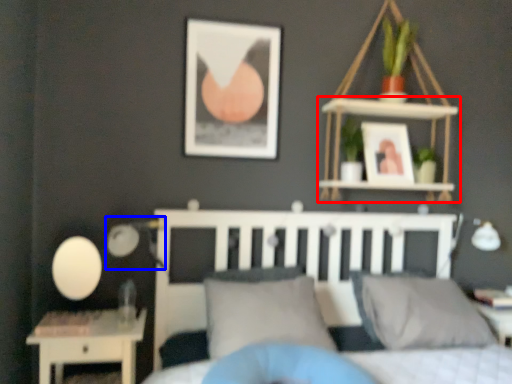
Question: Among these objects, which one is farthest to the camera, shelf (highlighted by a red box) or table lamp (highlighted by a blue box)?

Choices:
 (A) shelf
 (B) table lamp

Answer: (A)